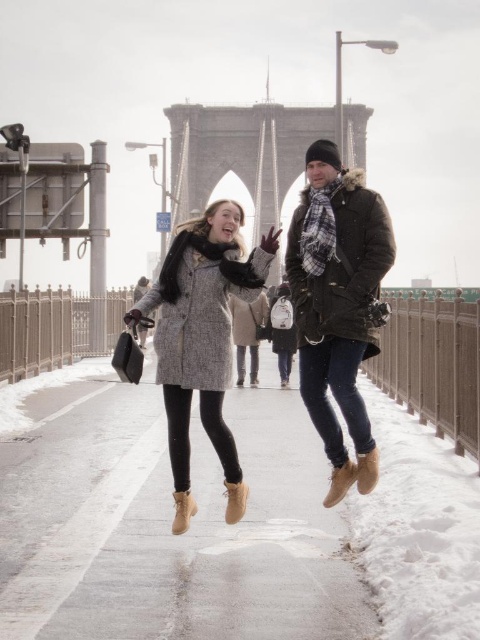
You are a photographer trying to capture the perfect shot of the two people jumping in the snow. You need to ensure both the matte gray coat at center and the brown woolen coat at center are clearly visible. Which coat should you focus on to ensure the taller one is in focus?

The brown woolen coat at center is taller than the matte gray coat at center, so focusing on the brown woolen coat at center will ensure the taller one is in focus.

You are a photographer trying to capture the perfect shot of the matte gray coat at center on the Brooklyn Bridge. If you want to frame the coat precisely at the center of your photo, which coordinates should you aim for?

You should aim for the coordinates point at (337, 305) to frame the matte gray coat at center precisely at the center of your photo.